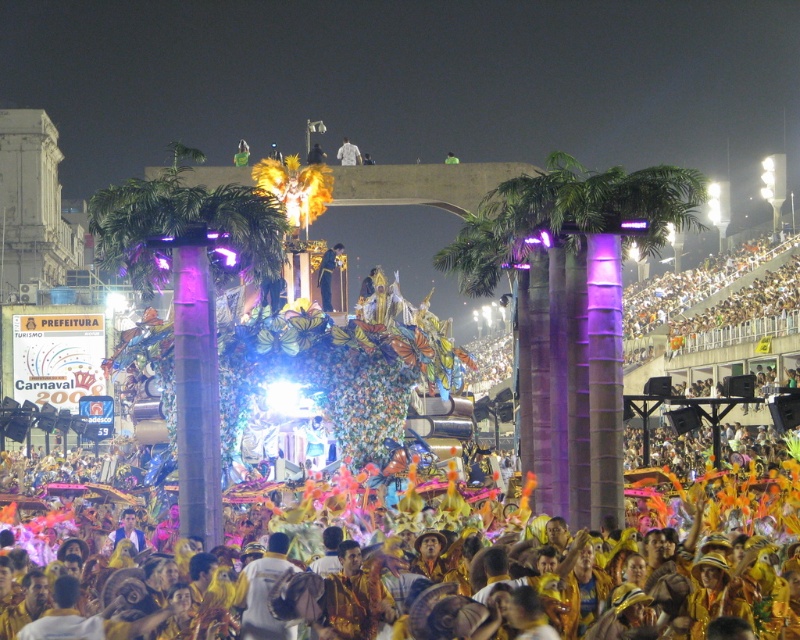
You are a photographer trying to capture both the green leafy palm at center and the purple metallic palm tree at center in a single shot. Which palm should you focus on to ensure both are in frame without zooming in or out?

The green leafy palm at center is smaller than the purple metallic palm tree at center, so focusing on the purple metallic palm tree at center will allow both to be captured in the frame since it is larger and central.

You are a photographer at the carnival parade. You want to take a photo of the white fabric at center and the purple metallic palm tree at center. Which object should you focus on first to ensure both are in the frame?

The purple metallic palm tree at center is in front of the white fabric at center, so you should focus on the purple metallic palm tree at center first to ensure both are in the frame.